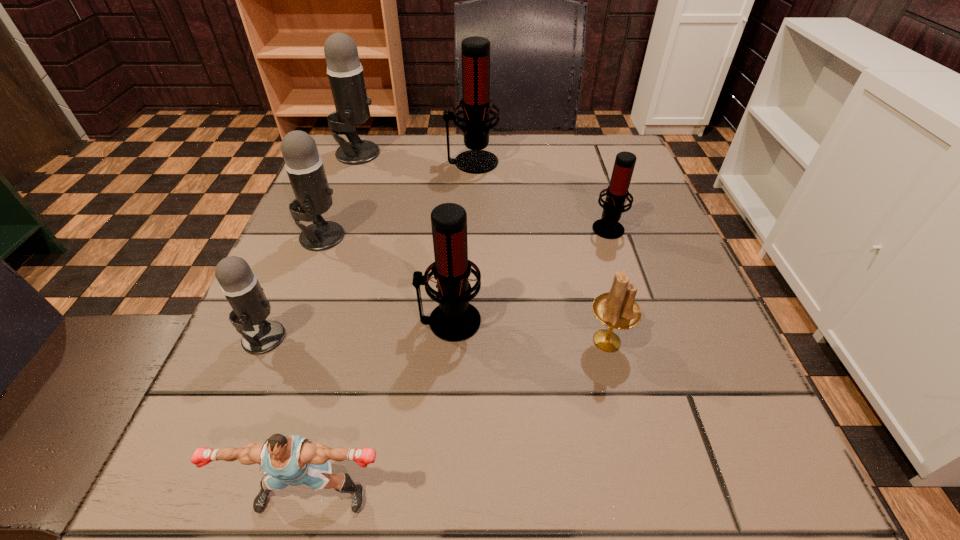
Find the location of a particular element. The width and height of the screenshot is (960, 540). candle holder that is at the right edge is located at coordinates (616, 309).

Find the location of a particular element. object that is at the far left corner is located at coordinates (344, 69).

Where is `object positioned at the near left corner`? object positioned at the near left corner is located at coordinates (293, 460).

The height and width of the screenshot is (540, 960). In the image, there is a desktop. In order to click on vacant space at the far edge in this screenshot , I will do `click(409, 178)`.

In the image, there is a desktop. Where is `vacant space at the near edge`? vacant space at the near edge is located at coordinates (455, 466).

Locate an element on the screen. The height and width of the screenshot is (540, 960). free space at the left edge of the desktop is located at coordinates (296, 264).

The height and width of the screenshot is (540, 960). In the image, there is a desktop. In order to click on vacant area at the right edge in this screenshot , I will do `click(655, 392)`.

Locate an element on the screen. This screenshot has height=540, width=960. vacant space at the far left corner is located at coordinates (382, 157).

This screenshot has height=540, width=960. I want to click on free point at the far right corner, so click(611, 141).

Where is `free region at the near right corner of the desktop`? The image size is (960, 540). free region at the near right corner of the desktop is located at coordinates (732, 474).